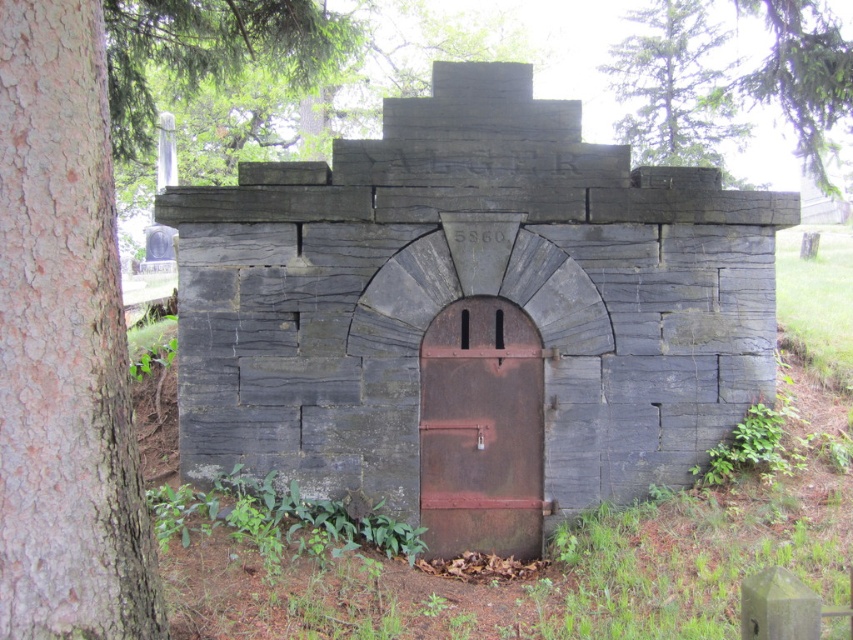
Question: Which of the following is the farthest from the observer?

Choices:
 (A) rusty metal door at center
 (B) green leafy tree at upper right

Answer: (A)

Question: In this image, where is rusty metal door at center located relative to green leafy tree at upper center?

Choices:
 (A) below
 (B) above

Answer: (A)

Question: Among these objects, which one is nearest to the camera?

Choices:
 (A) green leafy tree at upper right
 (B) rusty metal door at center

Answer: (A)

Question: Which of the following is the closest to the observer?

Choices:
 (A) green leafy tree at upper right
 (B) rusty metal door at center

Answer: (A)

Question: Does green leafy tree at upper center have a smaller size compared to green leafy tree at upper right?

Choices:
 (A) yes
 (B) no

Answer: (B)

Question: Can you confirm if green leafy tree at upper center is positioned above green leafy tree at upper right?

Choices:
 (A) yes
 (B) no

Answer: (A)